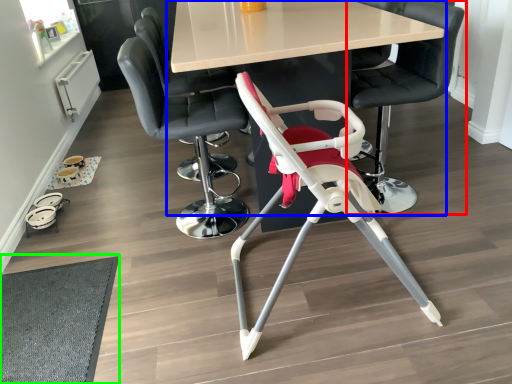
Question: Which is farther away from chair (highlighted by a red box)? table (highlighted by a blue box) or mat (highlighted by a green box)?

Choices:
 (A) table
 (B) mat

Answer: (B)